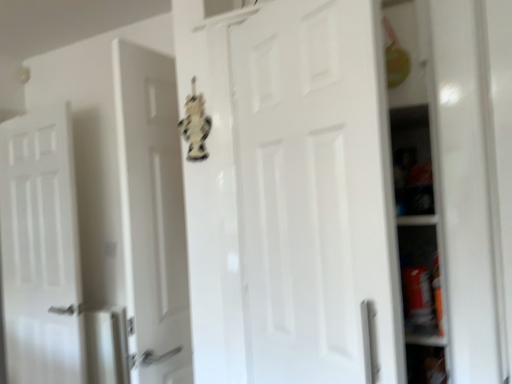
Question: Considering the relative sizes of white matte door at left, positioned as the 1th door in left-to-right order, and white matte door at center, the 2th door viewed from the left, in the image provided, is white matte door at left, positioned as the 1th door in left-to-right order, bigger than white matte door at center, the 2th door viewed from the left,?

Choices:
 (A) no
 (B) yes

Answer: (B)

Question: Is white matte door at left, which is counted as the 2th door, starting from the right, behind white matte door at center, the 2th door viewed from the left?

Choices:
 (A) no
 (B) yes

Answer: (B)

Question: From a real-world perspective, is white matte door at left, which appears as the second door when viewed from the front, located higher than white matte door at center, the 2th door viewed from the left?

Choices:
 (A) no
 (B) yes

Answer: (A)

Question: Is white matte door at center, which is counted as the first door, starting from the front, inside white matte door at left, positioned as the 1th door in left-to-right order?

Choices:
 (A) yes
 (B) no

Answer: (B)

Question: Can you confirm if white matte door at left, which is counted as the 2th door, starting from the right, is taller than white matte door at center, the second door positioned from the back?

Choices:
 (A) yes
 (B) no

Answer: (A)

Question: From a real-world perspective, does white matte door at left, which appears as the second door when viewed from the front, sit lower than white matte door at center, the 2th door viewed from the left?

Choices:
 (A) no
 (B) yes

Answer: (B)

Question: Is white matte door at left, positioned as the 1th door in left-to-right order, at the back of white matte door at center, the second door positioned from the back?

Choices:
 (A) no
 (B) yes

Answer: (A)

Question: Is white matte door at center, which is counted as the first door, starting from the front, wider than white matte door at left, which appears as the second door when viewed from the front?

Choices:
 (A) no
 (B) yes

Answer: (A)

Question: From a real-world perspective, is white matte door at center, the 2th door viewed from the left, below white matte door at left, which appears as the second door when viewed from the front?

Choices:
 (A) no
 (B) yes

Answer: (A)

Question: Does white matte door at center, which is counted as the first door, starting from the front, have a lesser height compared to white matte door at left, which appears as the second door when viewed from the front?

Choices:
 (A) yes
 (B) no

Answer: (A)

Question: From the image's perspective, is white matte door at center, the second door positioned from the back, above white matte door at left, which is counted as the 2th door, starting from the right?

Choices:
 (A) yes
 (B) no

Answer: (A)

Question: Considering the relative positions of white matte door at center, the first door in the right-to-left sequence, and white matte door at left, which is the first door in back-to-front order, in the image provided, is white matte door at center, the first door in the right-to-left sequence, in front of white matte door at left, which is the first door in back-to-front order,?

Choices:
 (A) no
 (B) yes

Answer: (B)

Question: From the image's perspective, is white matte door at left, which is counted as the 2th door, starting from the right, located above or below white matte door at center, the first door in the right-to-left sequence?

Choices:
 (A) above
 (B) below

Answer: (B)